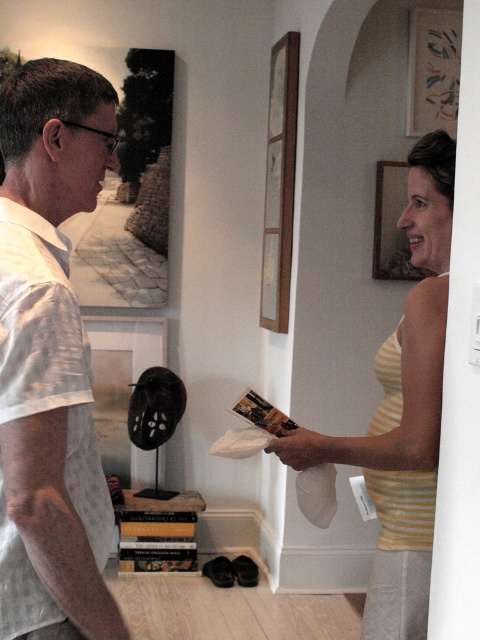
You are standing in the room and want to determine which of the two points, point (420, 609) or point (391, 244), is nearer to you. Based on the scene, which point is closer?

Point (420, 609) is closer to the viewer than point (391, 244).

You are an interior designer assessing the wall spacing in the room. The black matte picture frame at left and the matte wood picture frame at upper right are both to be hung on the same wall. Given their sizes, which frame requires more wall space?

The black matte picture frame at left requires more wall space because it is larger in size than the matte wood picture frame at upper right.